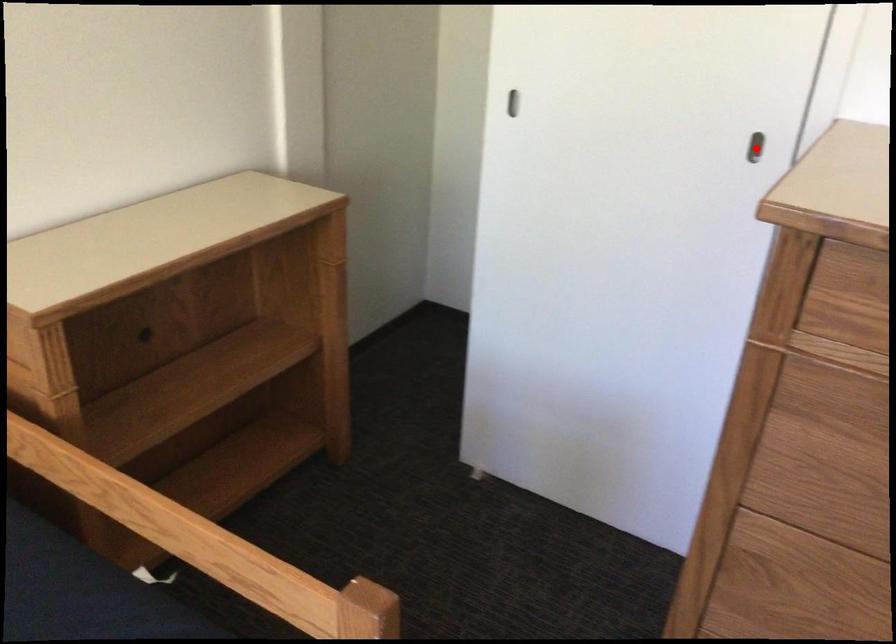
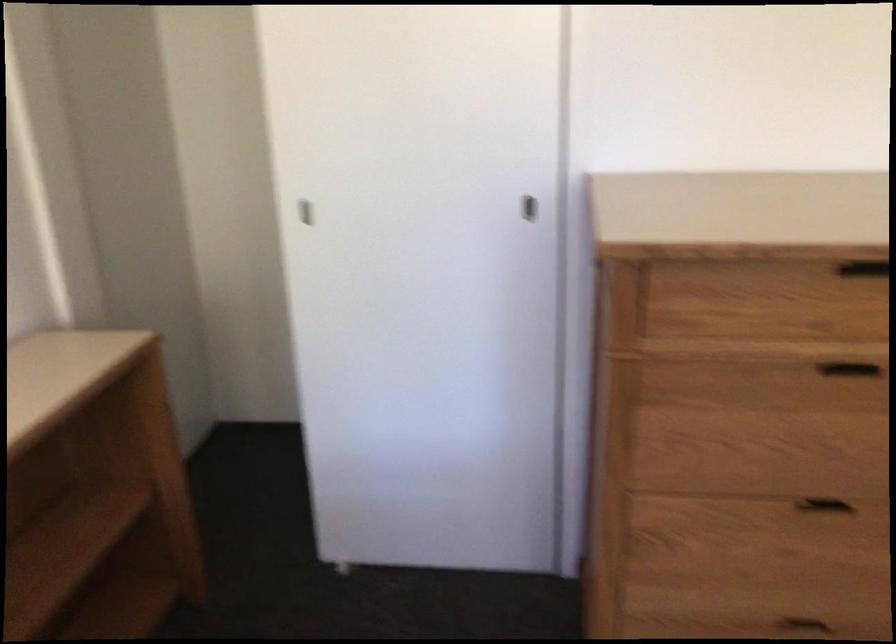
The point at the highlighted location is marked in the first image. Where is the corresponding point in the second image?

(530, 209)